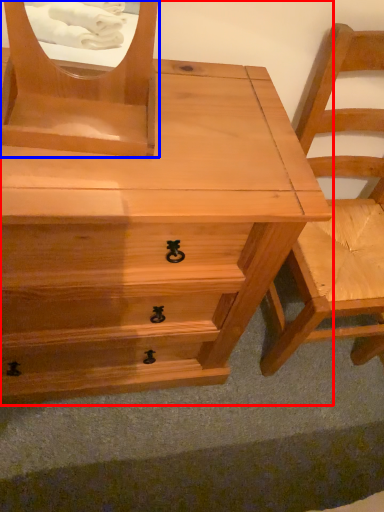
Question: Which of the following is the farthest to the observer, chest of drawers (highlighted by a red box) or mirror (highlighted by a blue box)?

Choices:
 (A) chest of drawers
 (B) mirror

Answer: (A)